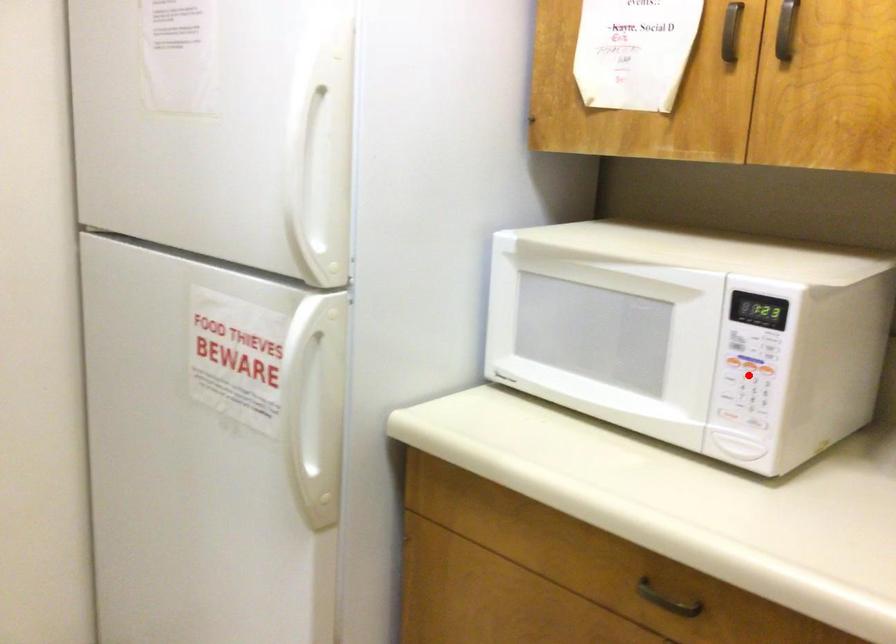
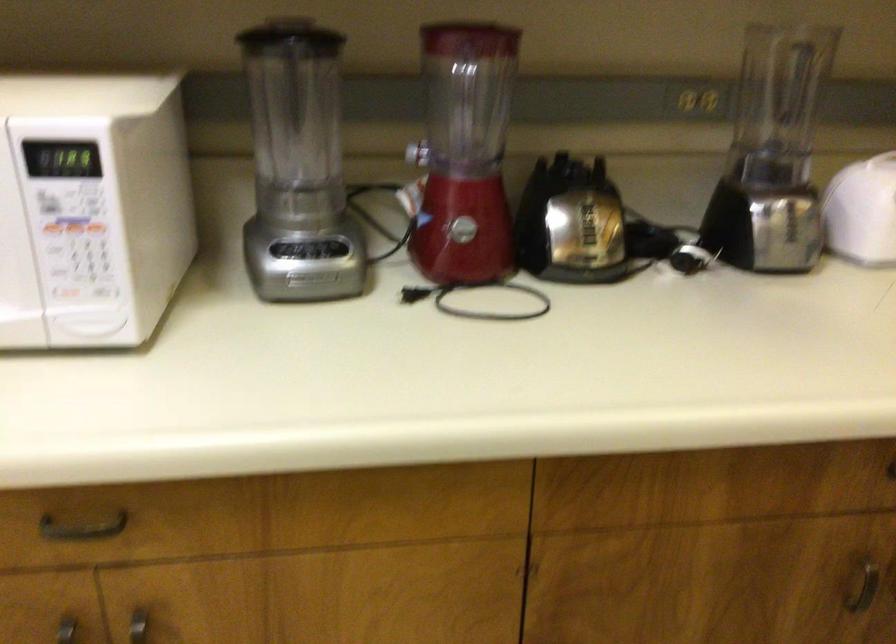
In the second image, find the point that corresponds to the highlighted location in the first image.

(74, 242)